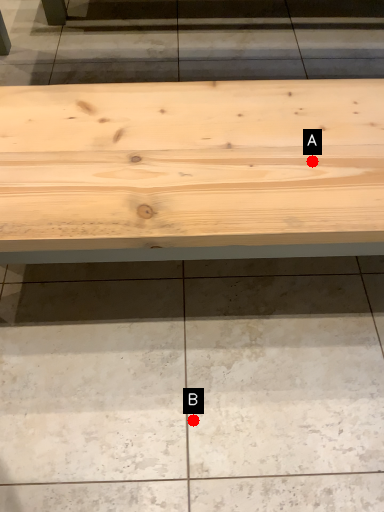
Question: Two points are circled on the image, labeled by A and B beside each circle. Which point is closer to the camera?

Choices:
 (A) A is closer
 (B) B is closer

Answer: (A)